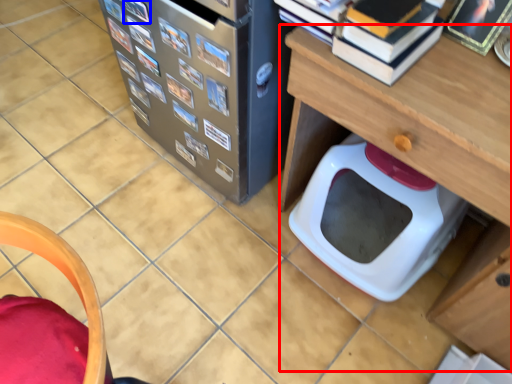
Question: Among these objects, which one is farthest to the camera, table (highlighted by a red box) or book (highlighted by a blue box)?

Choices:
 (A) table
 (B) book

Answer: (B)